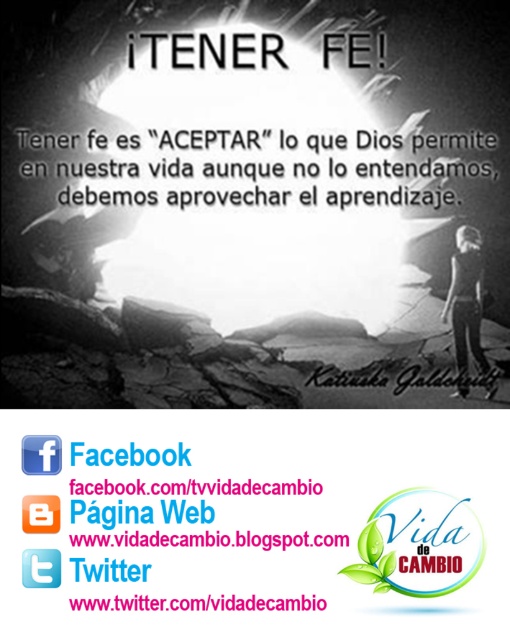
You are looking at the motivational poster and want to place a small sticker exactly halfway between the white text on transparent background at lower center and the orange plastic square at upper center. Which object will the sticker be closer to?

The sticker will be closer to the orange plastic square at upper center because the white text on transparent background at lower center is closer to the viewer than the orange plastic square at upper center, so the midpoint between them would be nearer to the upper object.

You are designing a poster and need to know the relative widths of the green leafy logo at center and the blue square at upper left. Based on the image, which one is wider?

The green leafy logo at center is wider than the blue square at upper left according to the description.

Based on the photo, you are designing a poster and want to place a new element between the white text on transparent background at lower center and the orange plastic square at upper center. Where should you place it?

The new element should be placed between the white text on transparent background at lower center and the orange plastic square at upper center, so it should be placed in the middle area between them.